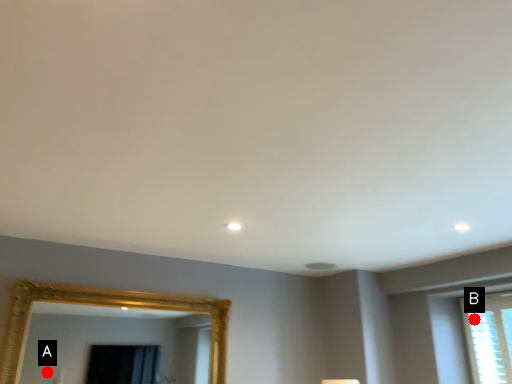
Question: Two points are circled on the image, labeled by A and B beside each circle. Among these points, which one is nearest to the camera?

Choices:
 (A) A is closer
 (B) B is closer

Answer: (B)